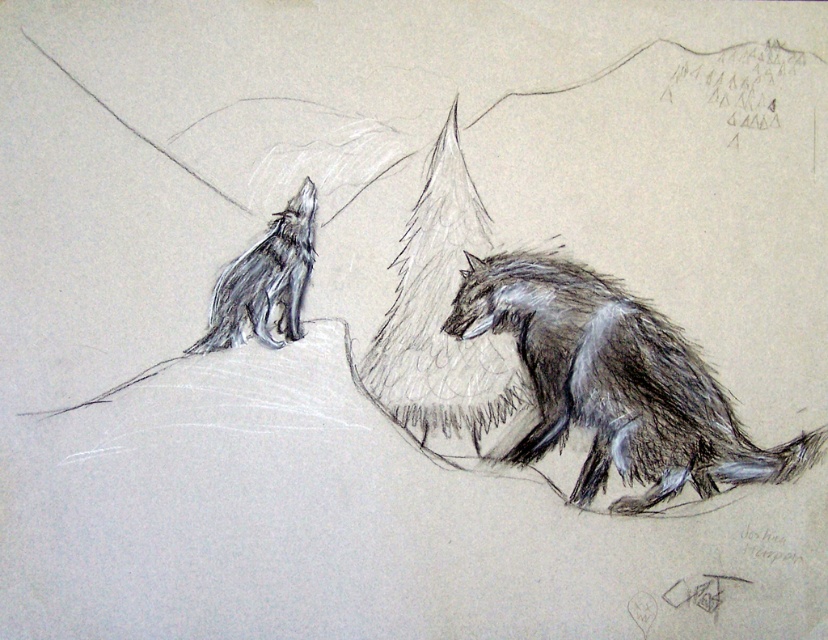
You are a photographer standing in the snowy landscape. You want to take a photo of both wolves but need to adjust your position so that the wolf at point (571, 326) and the wolf at point (244, 304) are both in focus. Which wolf should you focus on first to ensure both are sharp?

You should focus on the wolf at point (244, 304) first because it is closer to you than the wolf at point (571, 326). By focusing on the closer wolf, the farther one will also be in focus due to the depth of field.

You are an observer looking at the image. Which animal is located higher up in the image, the shaggy fur coyote at right or the shaggy fur wolf at upper left?

The shaggy fur wolf at upper left is positioned higher up in the image than the shaggy fur coyote at right.